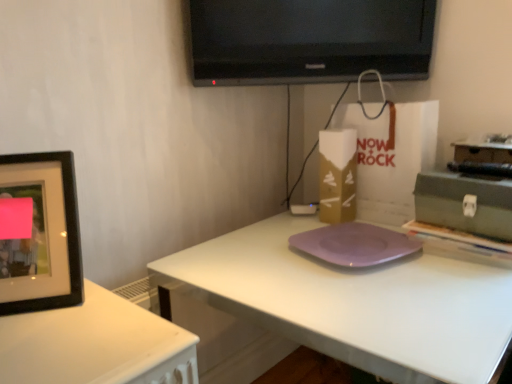
Question: Is purple matte plate at center a part of black matte picture frame at left?

Choices:
 (A) no
 (B) yes

Answer: (A)

Question: From the image's perspective, is black matte picture frame at left beneath purple matte plate at center?

Choices:
 (A) no
 (B) yes

Answer: (A)

Question: Is the depth of black matte picture frame at left greater than that of purple matte plate at center?

Choices:
 (A) no
 (B) yes

Answer: (B)

Question: Considering the relative sizes of black matte picture frame at left and purple matte plate at center in the image provided, is black matte picture frame at left bigger than purple matte plate at center?

Choices:
 (A) no
 (B) yes

Answer: (A)

Question: Is black matte picture frame at left looking in the opposite direction of purple matte plate at center?

Choices:
 (A) no
 (B) yes

Answer: (A)

Question: Considering the positions of point (x=453, y=304) and point (x=12, y=228), is point (x=453, y=304) closer or farther from the camera than point (x=12, y=228)?

Choices:
 (A) closer
 (B) farther

Answer: (B)

Question: Which is correct: purple matte plate at center is inside black matte picture frame at left, or outside of it?

Choices:
 (A) inside
 (B) outside

Answer: (B)

Question: Is purple matte plate at center in front of or behind black matte picture frame at left in the image?

Choices:
 (A) behind
 (B) front

Answer: (B)

Question: Is purple matte plate at center wider or thinner than black matte picture frame at left?

Choices:
 (A) wide
 (B) thin

Answer: (A)

Question: In the image, is purple matte plate at center on the left side or the right side of gold cardboard box at center?

Choices:
 (A) right
 (B) left

Answer: (A)

Question: Considering the positions of point (351, 311) and point (338, 200), is point (351, 311) closer or farther from the camera than point (338, 200)?

Choices:
 (A) closer
 (B) farther

Answer: (A)

Question: Looking at their shapes, would you say purple matte plate at center is wider or thinner than gold cardboard box at center?

Choices:
 (A) thin
 (B) wide

Answer: (B)

Question: From a real-world perspective, relative to gold cardboard box at center, is purple matte plate at center vertically above or below?

Choices:
 (A) above
 (B) below

Answer: (B)

Question: From a real-world perspective, is black glossy tv at upper center physically located above or below purple matte plate at center?

Choices:
 (A) below
 (B) above

Answer: (B)

Question: Is black glossy tv at upper center to the left or to the right of purple matte plate at center in the image?

Choices:
 (A) left
 (B) right

Answer: (A)